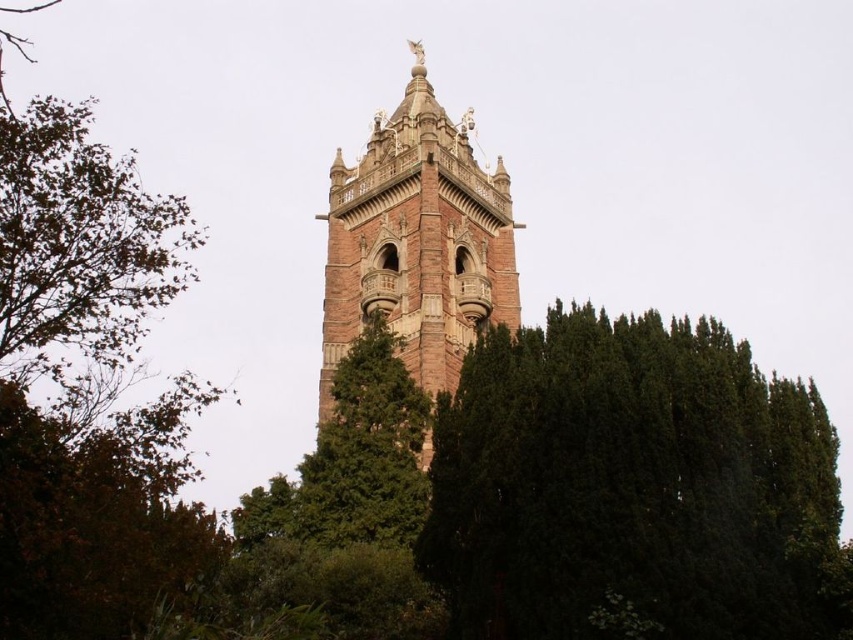
Question: Is green leafy tree at center below brown stone tower at center?

Choices:
 (A) yes
 (B) no

Answer: (A)

Question: Is green leafy tree at center above brown stone tower at center?

Choices:
 (A) no
 (B) yes

Answer: (A)

Question: Is the position of green leafy tree at center more distant than that of brown stone tower at center?

Choices:
 (A) yes
 (B) no

Answer: (B)